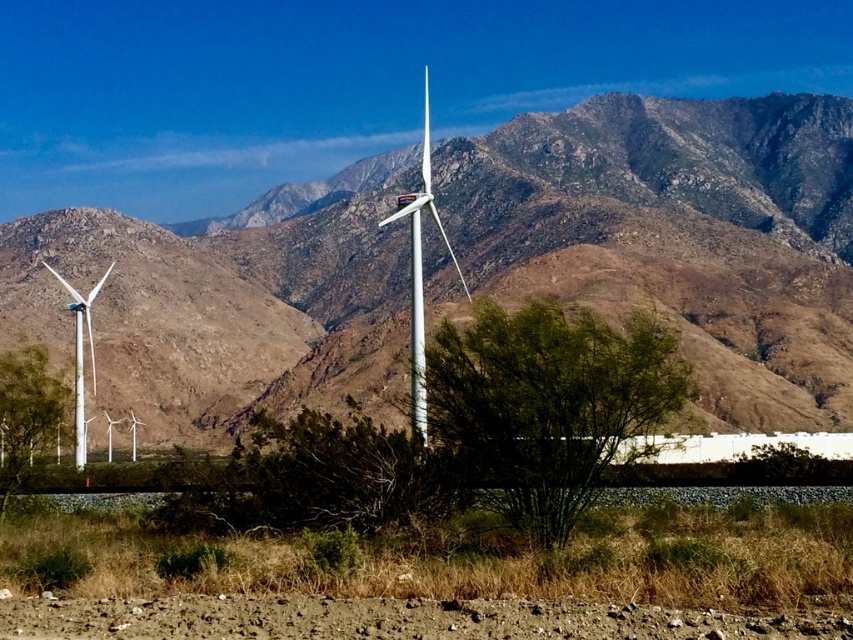
Is white matte wind turbine at center further to camera compared to white matte wind turbine at left?

No, it is in front of white matte wind turbine at left.

Is white matte wind turbine at center taller than white matte wind turbine at left?

Indeed, white matte wind turbine at center has a greater height compared to white matte wind turbine at left.

Does point (410, 330) come closer to viewer compared to point (84, 444)?

No, it is behind (84, 444).

Where is `white matte wind turbine at center`? white matte wind turbine at center is located at coordinates (421, 272).

Between brown rocky mountain range at center and white matte wind turbine at center, which one has more height?

With more height is brown rocky mountain range at center.

How far apart are brown rocky mountain range at center and white matte wind turbine at center?

73.56 meters

Identify the location of brown rocky mountain range at center. This screenshot has height=640, width=853. (679, 236).

The image size is (853, 640). Identify the location of brown rocky mountain range at center. (679, 236).

Does brown rocky mountain range at center appear on the right side of white matte wind turbine at left?

Yes, brown rocky mountain range at center is to the right of white matte wind turbine at left.

Is point (811, 188) more distant than point (80, 371)?

Yes, it is behind point (80, 371).

Where is `brown rocky mountain range at center`? brown rocky mountain range at center is located at coordinates (679, 236).